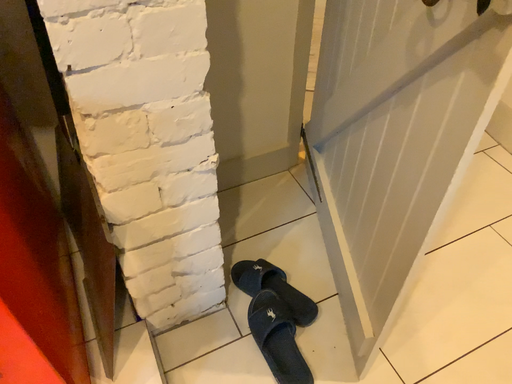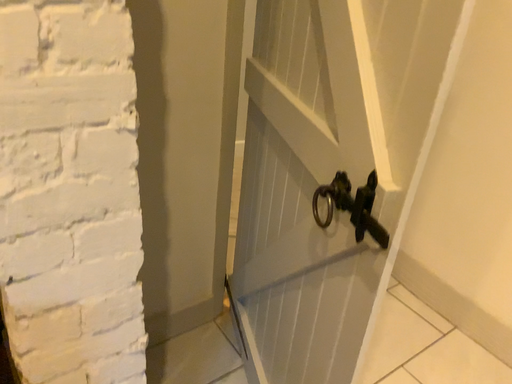
Question: How did the camera likely rotate when shooting the video?

Choices:
 (A) rotated right
 (B) rotated left

Answer: (A)